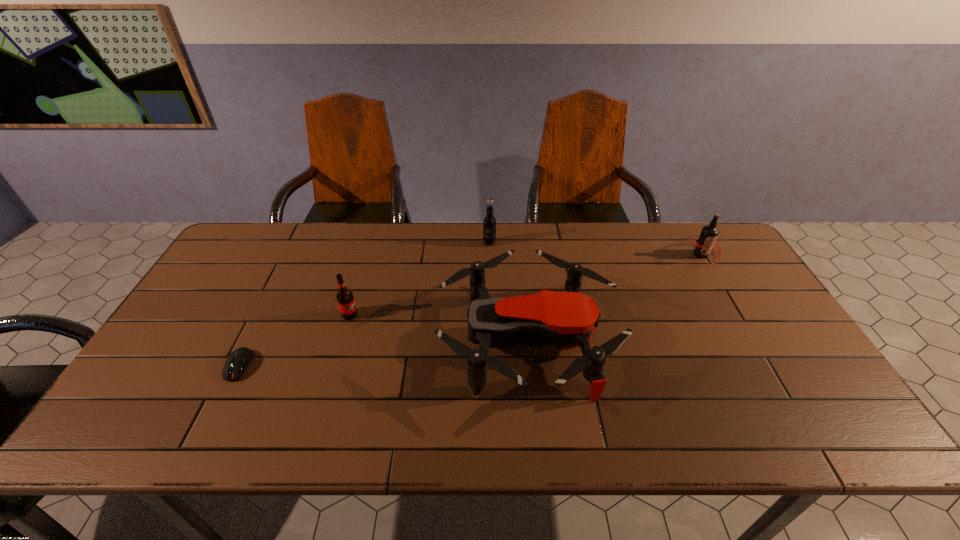
Locate an element on the screen. This screenshot has height=540, width=960. the second root beer from right to left is located at coordinates (489, 223).

I want to click on the rightmost root beer, so click(706, 241).

In order to click on the leftmost root beer in this screenshot , I will do `click(345, 299)`.

Identify the location of the nearest root beer. (345, 299).

Locate an element on the screen. drone is located at coordinates (568, 320).

In order to click on the leftmost object in this screenshot , I will do `click(236, 363)`.

Identify the location of the shortest object. pyautogui.click(x=236, y=363).

Where is `free space located 0.290m on the label of the second root beer from left to right`? This screenshot has height=540, width=960. free space located 0.290m on the label of the second root beer from left to right is located at coordinates (492, 309).

Where is `free spot located 0.400m on the label of the rightmost object`? The width and height of the screenshot is (960, 540). free spot located 0.400m on the label of the rightmost object is located at coordinates (772, 374).

Where is `free space located 0.210m on the left of the nearest root beer`? The image size is (960, 540). free space located 0.210m on the left of the nearest root beer is located at coordinates click(x=267, y=314).